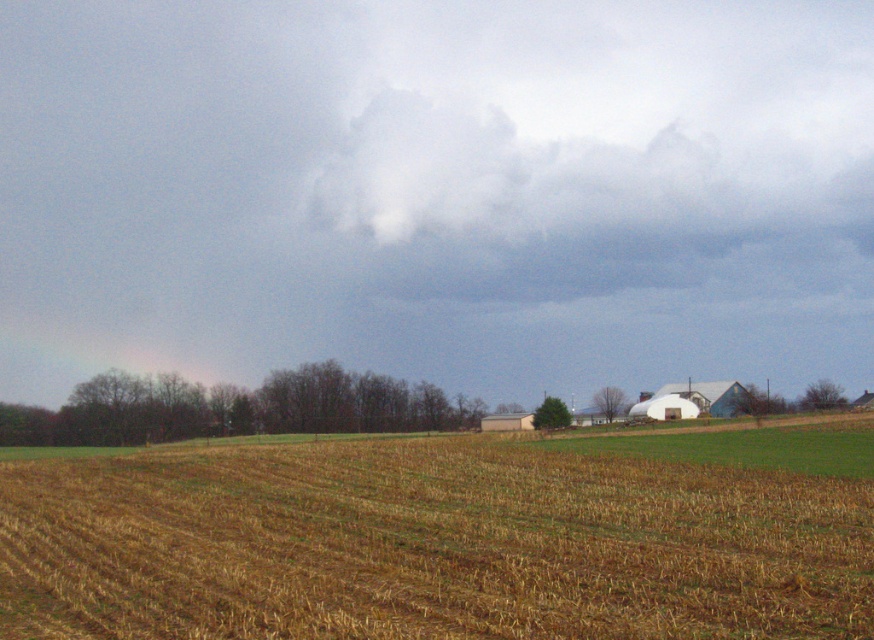
Is white fluffy cloud at upper center shorter than brown straw at center?

No.

Who is positioned more to the right, white fluffy cloud at upper center or brown straw at center?

brown straw at center

Is point (108, 61) farther from camera compared to point (74, 609)?

Yes, it is behind point (74, 609).

Locate an element on the screen. white fluffy cloud at upper center is located at coordinates (437, 193).